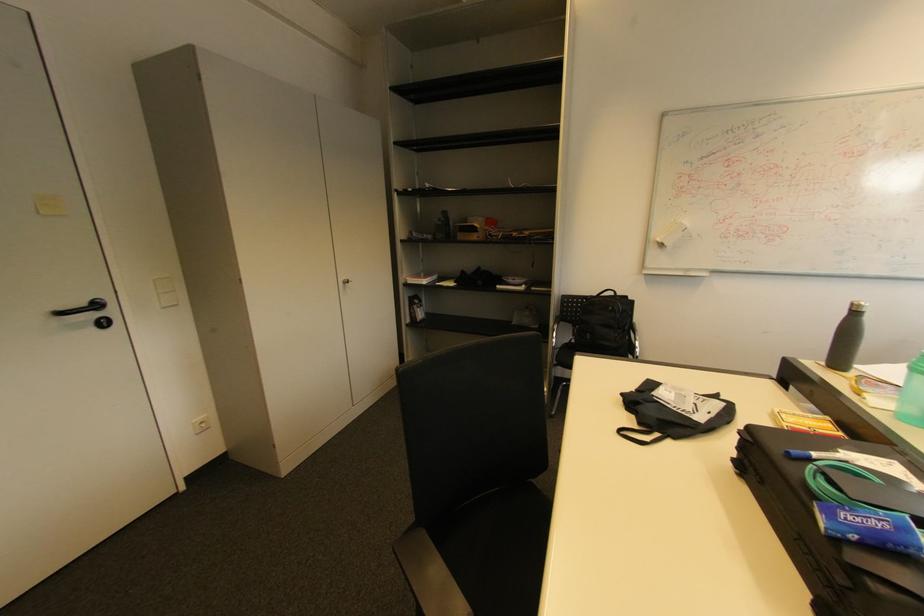
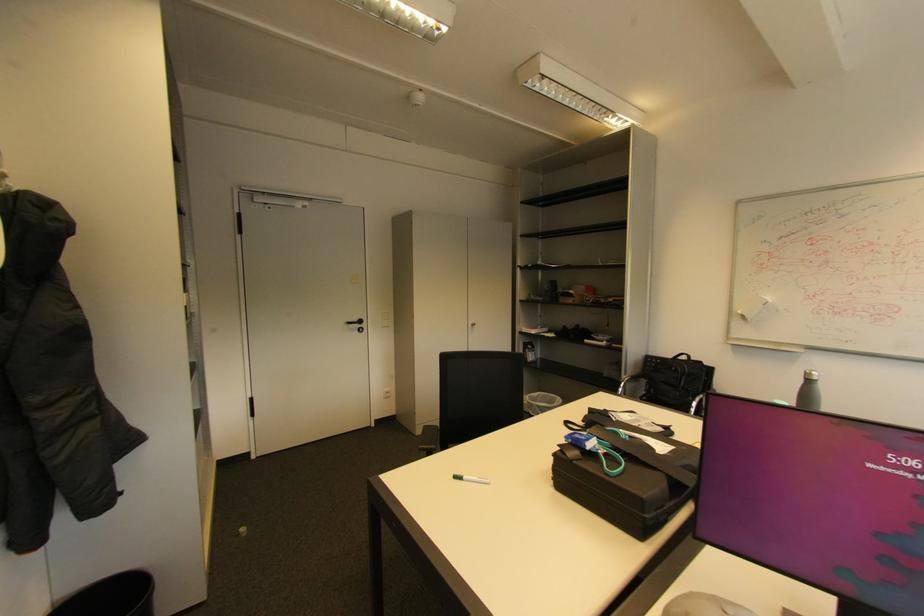
In the second image, find the point that corresponds to pixel 285 479 in the first image.

(420, 436)